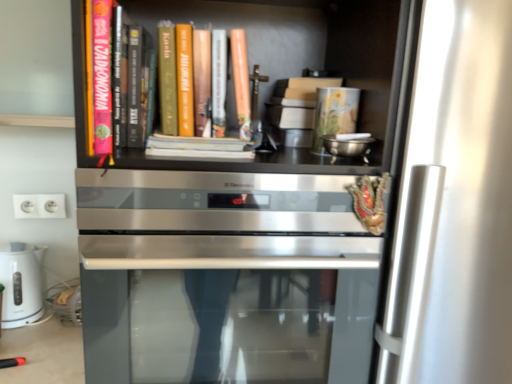
Question: Is matte orange book at center, the 1th book from the right, turned away from satin silver oven at center?

Choices:
 (A) yes
 (B) no

Answer: (B)

Question: From a real-world perspective, is matte orange book at center, positioned as the second book in left-to-right order, over satin silver oven at center?

Choices:
 (A) no
 (B) yes

Answer: (B)

Question: Is matte orange book at center, positioned as the second book in left-to-right order, far from satin silver oven at center?

Choices:
 (A) no
 (B) yes

Answer: (A)

Question: Is matte orange book at center, positioned as the second book in left-to-right order, shorter than satin silver oven at center?

Choices:
 (A) yes
 (B) no

Answer: (A)

Question: Is matte orange book at center, the 1th book from the right, wider than satin silver oven at center?

Choices:
 (A) yes
 (B) no

Answer: (B)

Question: Relative to white glossy electric kettle at lower left, is white plastic electrical outlet at lower left in front or behind?

Choices:
 (A) front
 (B) behind

Answer: (B)

Question: Is white plastic electrical outlet at lower left taller or shorter than white glossy electric kettle at lower left?

Choices:
 (A) tall
 (B) short

Answer: (B)

Question: From a real-world perspective, is white plastic electrical outlet at lower left above or below white glossy electric kettle at lower left?

Choices:
 (A) above
 (B) below

Answer: (A)

Question: Is white plastic electrical outlet at lower left wider or thinner than white glossy electric kettle at lower left?

Choices:
 (A) thin
 (B) wide

Answer: (A)

Question: From the image's perspective, relative to matte orange book at center, the 1th book from the right, is satin silver oven at center above or below?

Choices:
 (A) below
 (B) above

Answer: (A)

Question: From a real-world perspective, relative to matte orange book at center, positioned as the second book in left-to-right order, is satin silver oven at center vertically above or below?

Choices:
 (A) above
 (B) below

Answer: (B)

Question: Considering the relative positions of satin silver oven at center and matte orange book at center, positioned as the second book in left-to-right order, in the image provided, is satin silver oven at center to the left or to the right of matte orange book at center, positioned as the second book in left-to-right order,?

Choices:
 (A) left
 (B) right

Answer: (B)

Question: Choose the correct answer: Is satin silver oven at center inside matte orange book at center, positioned as the second book in left-to-right order, or outside it?

Choices:
 (A) inside
 (B) outside

Answer: (B)

Question: Considering the positions of point click(233, 69) and point click(8, 248), is point click(233, 69) closer or farther from the camera than point click(8, 248)?

Choices:
 (A) closer
 (B) farther

Answer: (A)

Question: In terms of height, does matte orange book at center, positioned as the second book in left-to-right order, look taller or shorter compared to white glossy electric kettle at lower left?

Choices:
 (A) short
 (B) tall

Answer: (B)